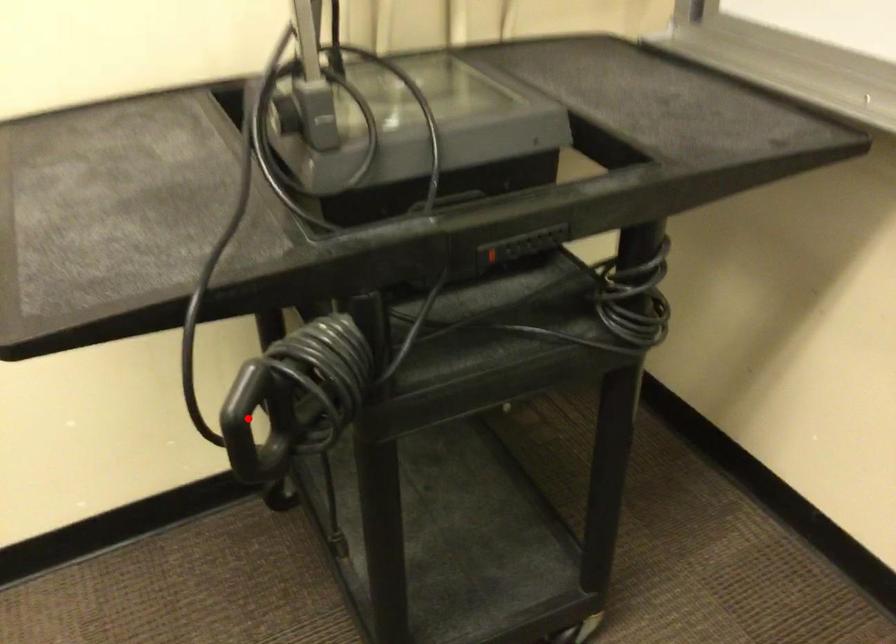
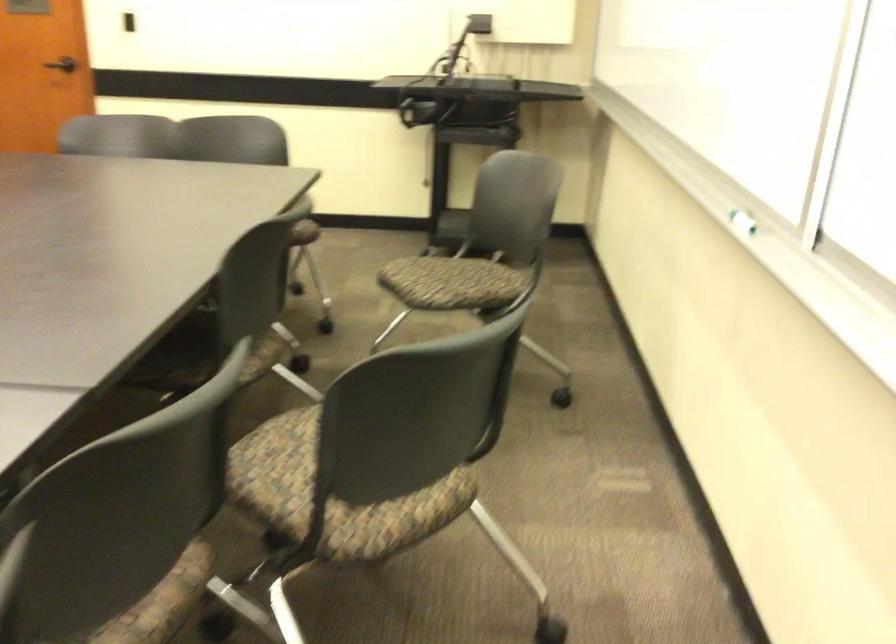
Question: I am providing you with two images of the same scene from different viewpoints. A red point is marked on the first image. At the location where the point appears in image 1, is it still visible in image 2?

Choices:
 (A) Yes
 (B) No

Answer: (B)